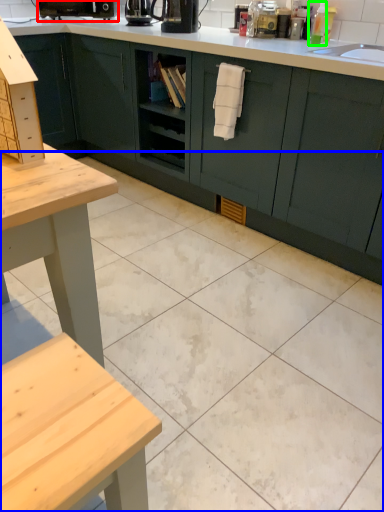
Question: Based on their relative distances, which object is nearer to coffee machine (highlighted by a red box)? Choose from ceramic tile (highlighted by a blue box) and toiletry (highlighted by a green box).

Choices:
 (A) ceramic tile
 (B) toiletry

Answer: (B)